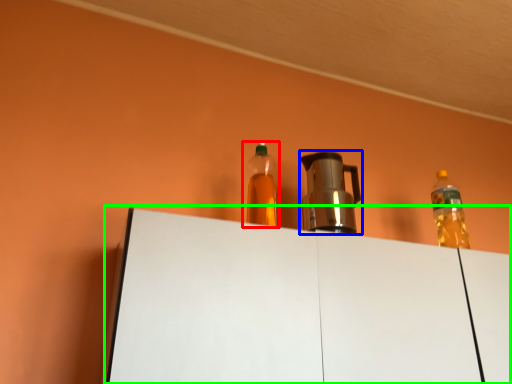
Question: Which object is the closest to the bottle (highlighted by a red box)? Choose among these: coffeepot (highlighted by a blue box) or table (highlighted by a green box).

Choices:
 (A) coffeepot
 (B) table

Answer: (B)